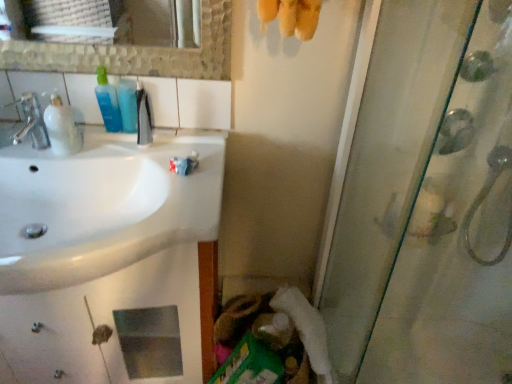
Question: In terms of width, does white glossy sink at left look wider or thinner when compared to blue translucent bottle at upper left, acting as the 2th mouthwash starting from the left?

Choices:
 (A) thin
 (B) wide

Answer: (B)

Question: In the image, is white glossy sink at left positioned in front of or behind blue translucent bottle at upper left, acting as the 2th mouthwash starting from the left?

Choices:
 (A) behind
 (B) front

Answer: (B)

Question: Which object is positioned farthest from the blue translucent bottle at upper left, the 3th mouthwash when ordered from right to left?

Choices:
 (A) white fluffy toilet paper at lower center
 (B) transparent glass shower door at right
 (C) blue translucent bottle at upper left, which is the 3th mouthwash from left to right
 (D) translucent plastic mouthwash at left, which is counted as the 1th mouthwash, starting from the left
 (E) white glossy sink at left

Answer: (B)

Question: Estimate the real-world distances between objects in this image. Which object is closer to the blue translucent bottle at upper left, which is the 3th mouthwash from left to right?

Choices:
 (A) white fluffy toilet paper at lower center
 (B) transparent glass shower door at right
 (C) black plastic toothbrush at upper center, arranged as the fourth mouthwash when viewed from the left
 (D) white glossy sink at left
 (E) blue translucent bottle at upper left, the 3th mouthwash when ordered from right to left

Answer: (C)